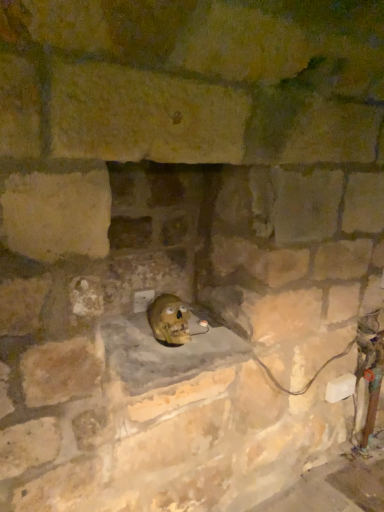
Find the location of `free region on the left part of yellow matte skull at center`. free region on the left part of yellow matte skull at center is located at coordinates (145, 341).